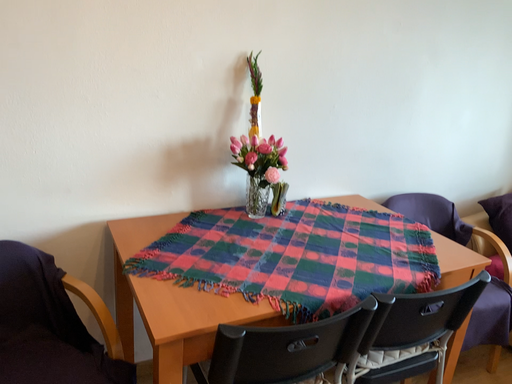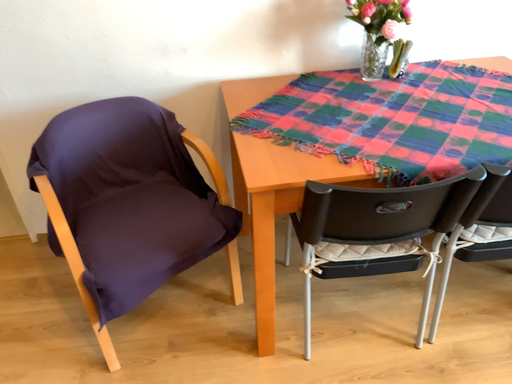
Question: How did the camera likely rotate when shooting the video?

Choices:
 (A) rotated upward
 (B) rotated downward

Answer: (B)